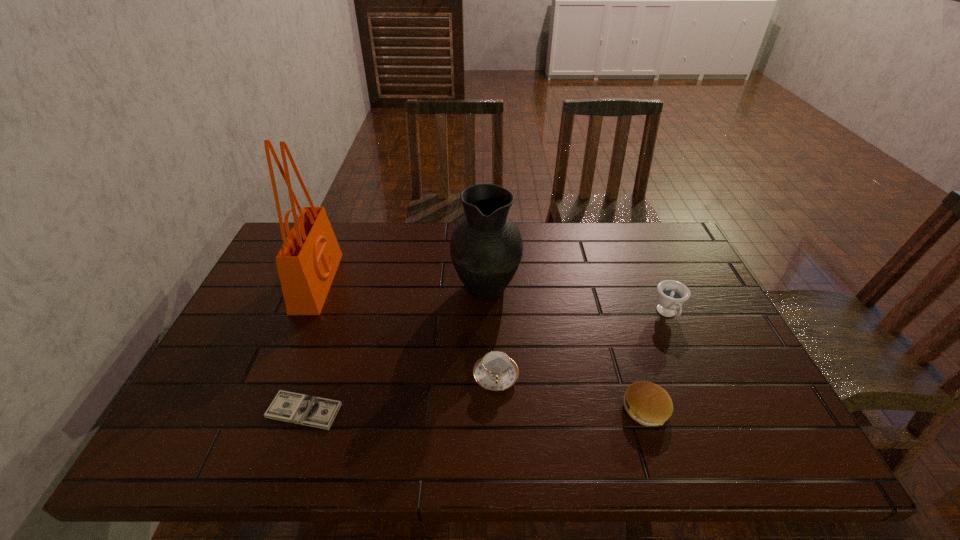
Identify the location of free spot located 0.180m on the side of the pitcher with the handle. (485, 229).

The height and width of the screenshot is (540, 960). Identify the location of free spot located on the side of the pitcher with the handle. (485, 247).

I want to click on vacant position located on the side of the third tallest object with the handle, so click(707, 401).

Where is `free region located on the side with the handle of the nearer teacup`? This screenshot has height=540, width=960. free region located on the side with the handle of the nearer teacup is located at coordinates (497, 423).

Locate an element on the screen. Image resolution: width=960 pixels, height=540 pixels. free location located on the back of the second object from right to left is located at coordinates (623, 338).

Locate an element on the screen. This screenshot has width=960, height=540. vacant space located 0.170m on the back of the shortest object is located at coordinates point(329,338).

In order to click on tote bag located at the far edge in this screenshot , I will do `click(307, 262)`.

This screenshot has width=960, height=540. Find the location of `pitcher present at the far edge`. pitcher present at the far edge is located at coordinates (486, 247).

The height and width of the screenshot is (540, 960). I want to click on patty present at the near edge, so click(x=647, y=403).

The image size is (960, 540). I want to click on dollar located at the near edge, so click(x=318, y=412).